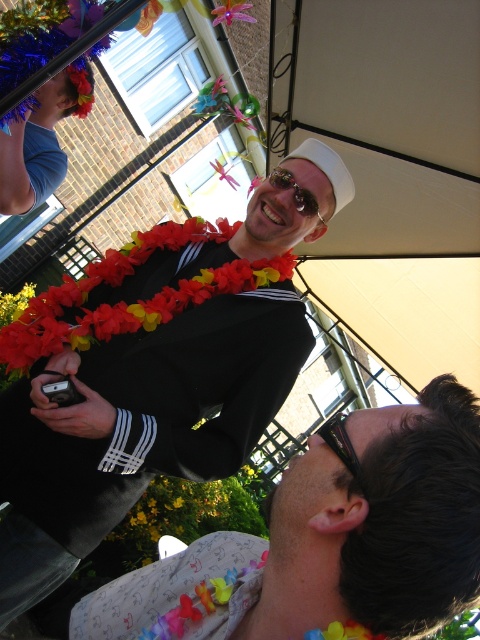
Who is higher up, white fabric canopy at upper center or translucent plastic flower at upper center?

translucent plastic flower at upper center

Is white fabric canopy at upper center smaller than translucent plastic flower at upper center?

Incorrect, white fabric canopy at upper center is not smaller in size than translucent plastic flower at upper center.

Is point (348, 136) closer to camera compared to point (239, 12)?

Yes, point (348, 136) is closer to viewer.

The image size is (480, 640). What are the coordinates of `white fabric canopy at upper center` in the screenshot? It's located at tap(392, 168).

This screenshot has width=480, height=640. Describe the element at coordinates (334, 540) in the screenshot. I see `satin black sailor at upper center` at that location.

Is point (289, 484) positioned behind point (249, 276)?

No, (289, 484) is in front of (249, 276).

Describe the element at coordinates (334, 540) in the screenshot. I see `satin black sailor at upper center` at that location.

Identify the location of satin black sailor at upper center. (334, 540).

Is black plastic goggles at lower center closer to the viewer compared to floral lei at upper center?

Yes, black plastic goggles at lower center is in front of floral lei at upper center.

Is black plastic goggles at lower center wider than floral lei at upper center?

Yes.

This screenshot has width=480, height=640. Identify the location of black plastic goggles at lower center. (344, 449).